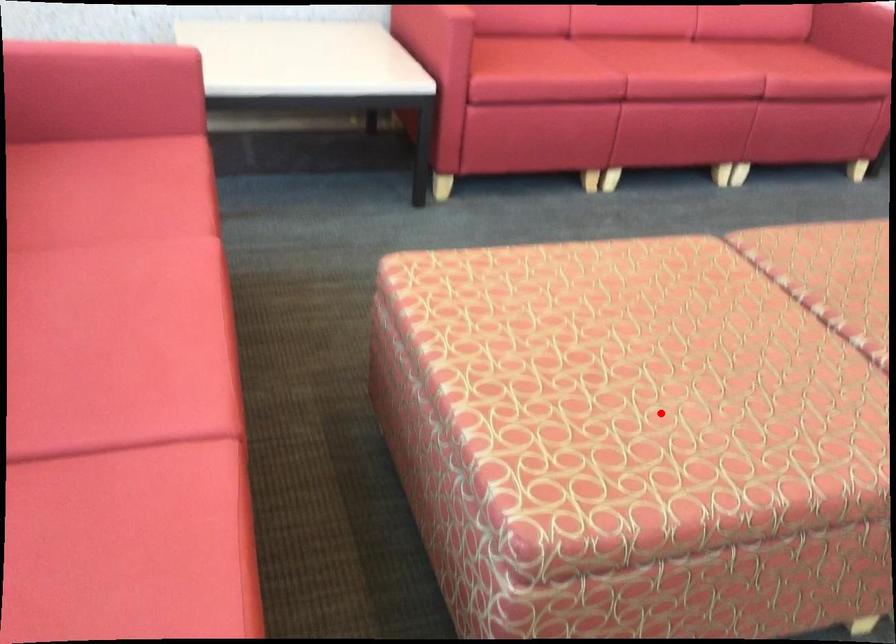
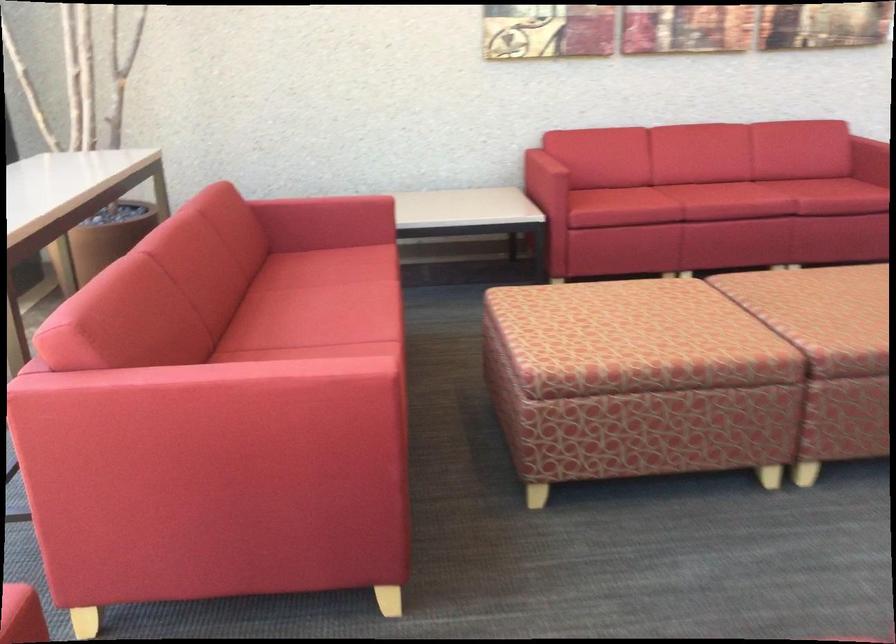
The point at the highlighted location is marked in the first image. Where is the corresponding point in the second image?

(627, 334)